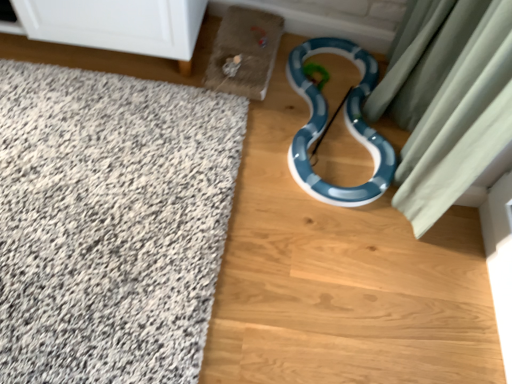
Find the location of a particular element. free point to the right of white shaggy bath mat at left is located at coordinates (334, 278).